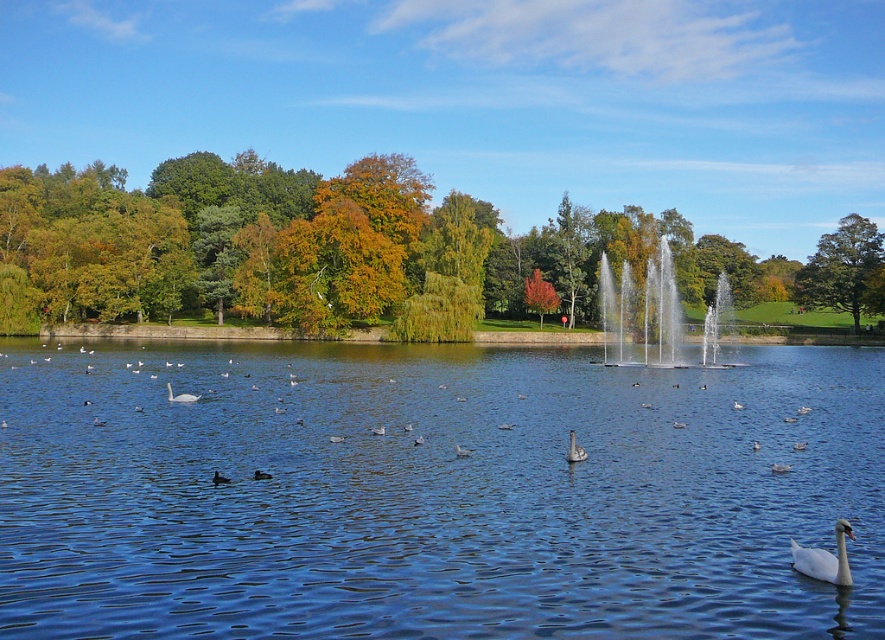
Question: Estimate the real-world distances between objects in this image. Which object is farther from the clear glass water at center?

Choices:
 (A) golden yellow leaves at center
 (B) brown matte duck at center
 (C) transparent blue water at center
 (D) white glossy swan at lower right

Answer: (D)

Question: Which object is positioned farthest from the white glossy swan at center?

Choices:
 (A) clear glass water at center
 (B) orange leafy tree at center
 (C) brown matte duck at center
 (D) golden yellow leaves at center

Answer: (D)

Question: Can you confirm if golden yellow leaves at center is wider than white glossy swan at center?

Choices:
 (A) yes
 (B) no

Answer: (A)

Question: Can you confirm if white glossy swan at lower right is positioned to the left of brown matte duck at lower center?

Choices:
 (A) no
 (B) yes

Answer: (A)

Question: Based on their relative distances, which object is farther from the brown matte duck at lower center?

Choices:
 (A) white glossy swan at lower right
 (B) brown matte duck at center

Answer: (A)

Question: Is transparent blue water at center wider than white glossy swan at lower right?

Choices:
 (A) no
 (B) yes

Answer: (B)